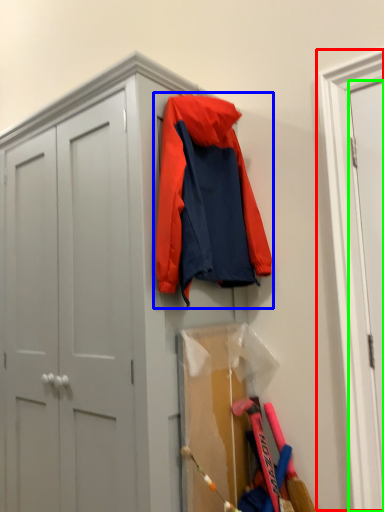
Question: Estimate the real-world distances between objects in this image. Which object is closer to door (highlighted by a red box), jacket (highlighted by a blue box) or door (highlighted by a green box)?

Choices:
 (A) jacket
 (B) door

Answer: (B)